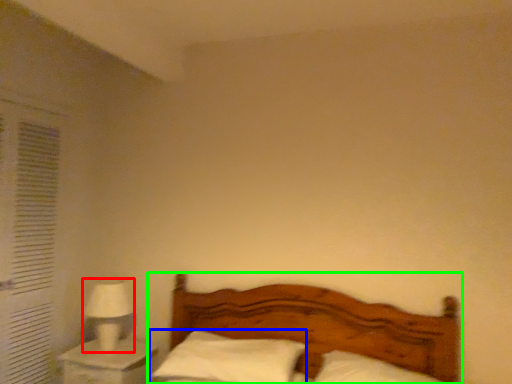
Question: Which object is the farthest from table lamp (highlighted by a red box)? Choose among these: pillow (highlighted by a blue box) or bed (highlighted by a green box).

Choices:
 (A) pillow
 (B) bed

Answer: (B)